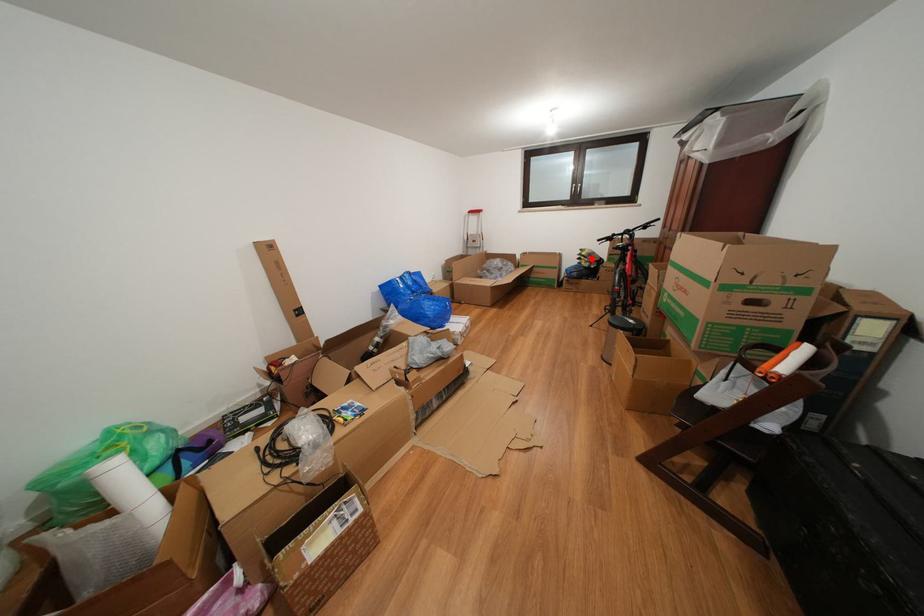
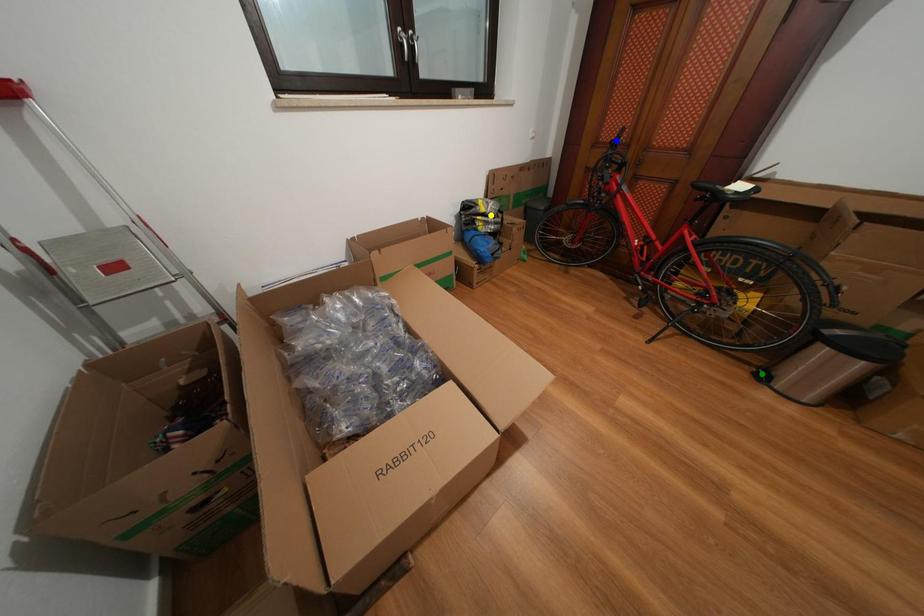
Question: I am providing you with two images of the same scene from different viewpoints. A red point is marked on the first image. You are given multiple points on the second image. In image 2, which mark is for the same physical point as the one in image 1?

Choices:
 (A) green point
 (B) yellow point
 (C) blue point

Answer: (B)